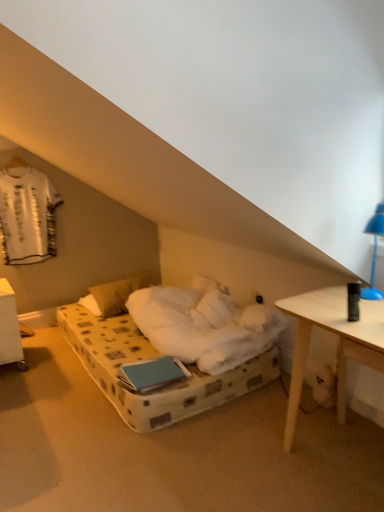
Question: Is blue plastic lamp at upper right taller or shorter than white soft pillow at center?

Choices:
 (A) tall
 (B) short

Answer: (A)

Question: Relative to white soft pillow at center, is blue plastic lamp at upper right in front or behind?

Choices:
 (A) front
 (B) behind

Answer: (A)

Question: Estimate the real-world distances between objects in this image. Which object is farther from the blue plastic lamp at upper right?

Choices:
 (A) white soft pillow at center
 (B) white plastic nightstand at lower left
 (C) white fabric shirt at upper left

Answer: (C)

Question: Considering the real-world distances, which object is farthest from the blue plastic lamp at upper right?

Choices:
 (A) white soft pillow at center
 (B) white fabric shirt at upper left
 (C) white plastic nightstand at lower left

Answer: (B)